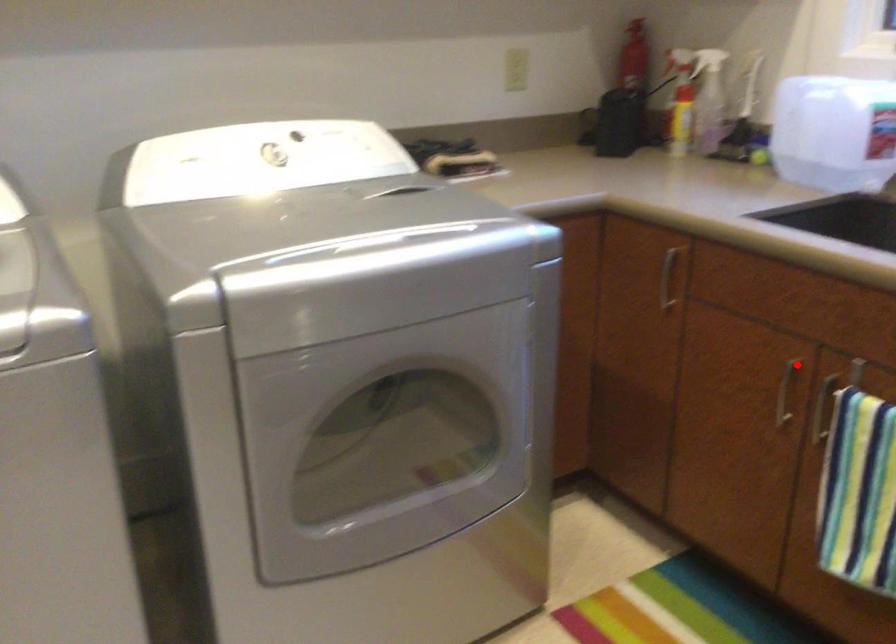
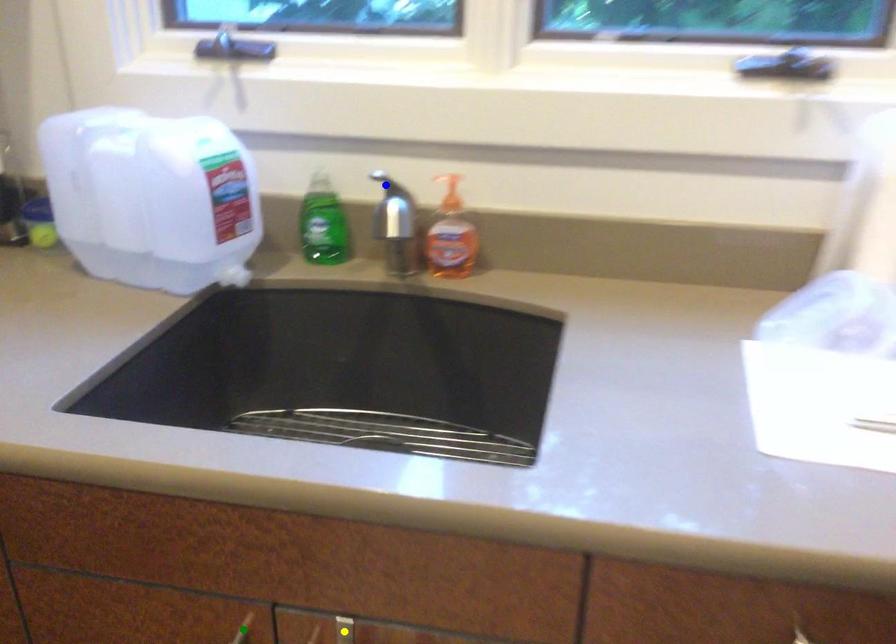
Question: I am providing you with two images of the same scene from different viewpoints. A red point is marked on the first image. You are given multiple points on the second image. In image 2, which mark is for the same physical point as the one in image 1?

Choices:
 (A) green point
 (B) yellow point
 (C) blue point

Answer: (A)